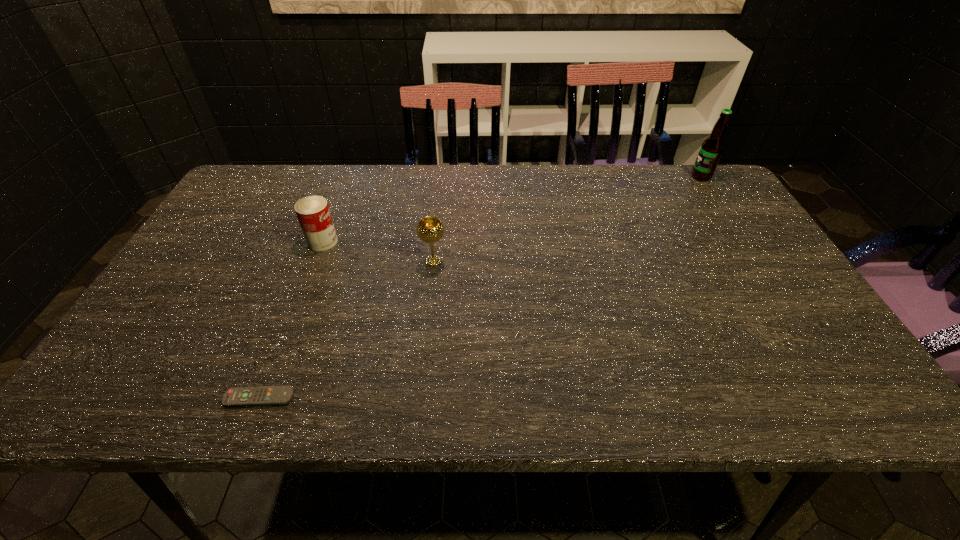
Locate an element on the screen. This screenshot has height=540, width=960. free space located on the right of the third object from left to right is located at coordinates (520, 261).

I want to click on vacant region located 0.220m on the front label of the can, so pos(419,241).

Identify the location of vacant position located on the left of the nearest object. (168, 397).

Image resolution: width=960 pixels, height=540 pixels. I want to click on object situated at the far edge, so click(x=712, y=147).

Locate an element on the screen. The width and height of the screenshot is (960, 540). object positioned at the near edge is located at coordinates (264, 395).

Identify the location of object present at the right edge. (712, 147).

In order to click on object present at the far right corner in this screenshot , I will do `click(712, 147)`.

The width and height of the screenshot is (960, 540). Find the location of `free location at the far edge`. free location at the far edge is located at coordinates (323, 186).

Where is `vacant region at the near edge`? The image size is (960, 540). vacant region at the near edge is located at coordinates (460, 393).

The image size is (960, 540). In order to click on free space at the right edge of the desktop in this screenshot , I will do `click(744, 232)`.